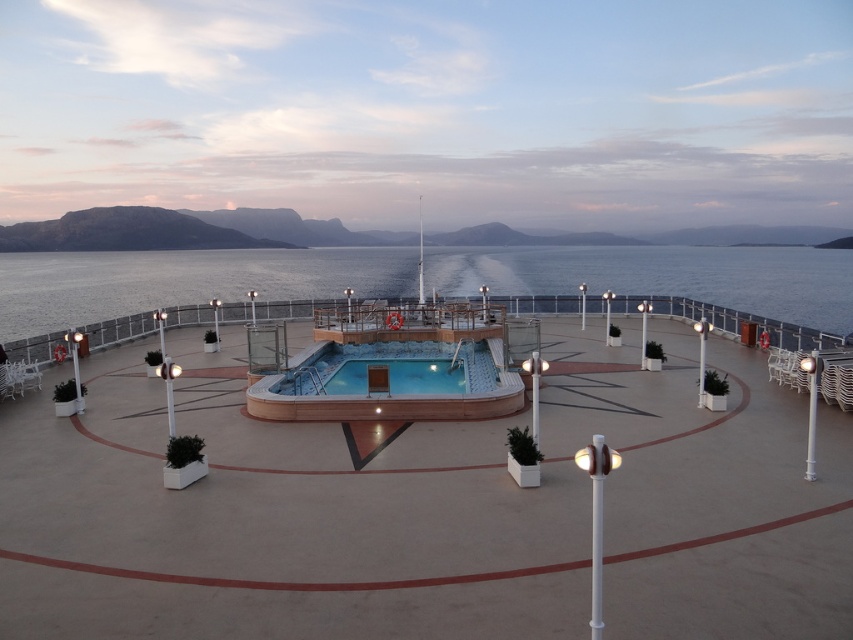
Question: Which point appears closest to the camera in this image?

Choices:
 (A) (247, 525)
 (B) (309, 369)

Answer: (A)

Question: Which is nearer to the clear blue water at center?

Choices:
 (A) smooth concrete deck at center
 (B) wooden swimming pool at center

Answer: (B)

Question: Is smooth concrete deck at center above clear blue water at center?

Choices:
 (A) no
 (B) yes

Answer: (A)

Question: Can you confirm if smooth concrete deck at center is bigger than clear blue water at center?

Choices:
 (A) no
 (B) yes

Answer: (A)

Question: Is smooth concrete deck at center below wooden swimming pool at center?

Choices:
 (A) no
 (B) yes

Answer: (B)

Question: Based on their relative distances, which object is farther from the wooden swimming pool at center?

Choices:
 (A) smooth concrete deck at center
 (B) clear blue water at center

Answer: (B)